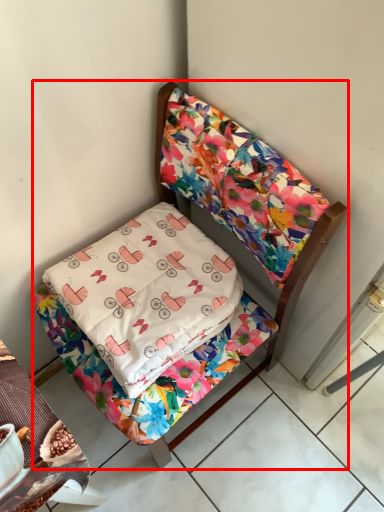
Question: From the image's perspective, what is the correct spatial positioning of furniture (annotated by the red box) in reference to pillow?

Choices:
 (A) below
 (B) above

Answer: (A)